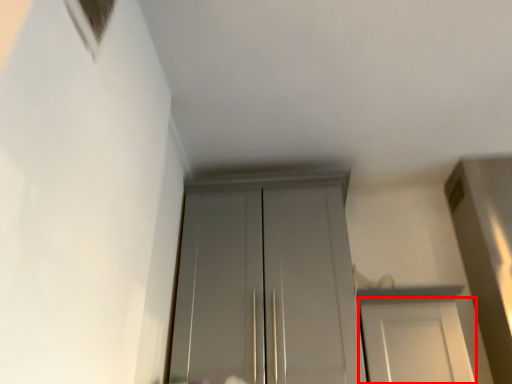
Question: Observing the image, what is the correct spatial positioning of door (annotated by the red box) in reference to door?

Choices:
 (A) right
 (B) left

Answer: (A)